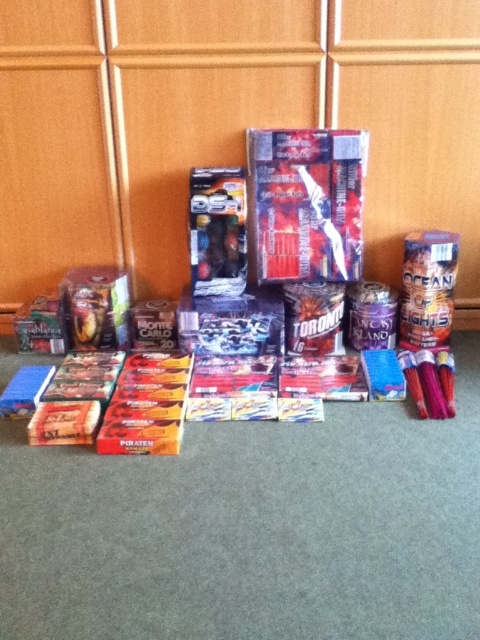
Can you confirm if shiny metallic box at center is positioned above metallic silver snack at right?

Yes.

Does shiny metallic box at center appear under metallic silver snack at right?

No.

Find the location of `shiny metallic box at center`. shiny metallic box at center is located at coordinates (307, 202).

Between metallic silver fireworks at center and metallic silver toy car at center, which one has less height?

With less height is metallic silver toy car at center.

Does metallic silver fireworks at center have a smaller size compared to metallic silver toy car at center?

Incorrect, metallic silver fireworks at center is not smaller in size than metallic silver toy car at center.

Locate an element on the screen. This screenshot has width=480, height=640. metallic silver fireworks at center is located at coordinates (295, 256).

The width and height of the screenshot is (480, 640). I want to click on metallic silver fireworks at center, so click(295, 256).

Measure the distance between metallic silver fireworks at center and metallic silver snack at right.

metallic silver fireworks at center and metallic silver snack at right are 11.48 inches apart from each other.

Is metallic silver fireworks at center below metallic silver snack at right?

Yes, metallic silver fireworks at center is below metallic silver snack at right.

Image resolution: width=480 pixels, height=640 pixels. Identify the location of metallic silver fireworks at center. (295, 256).